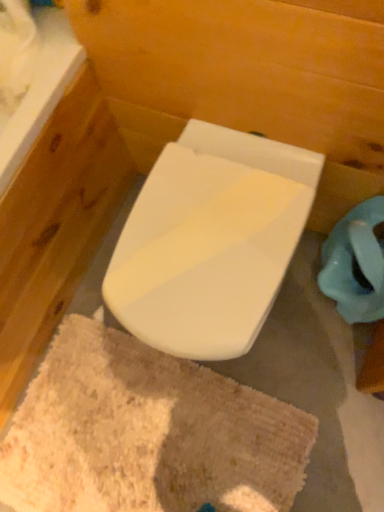
Question: Is beige shaggy bath mat at center in front of or behind white glossy toilet at center in the image?

Choices:
 (A) front
 (B) behind

Answer: (B)

Question: From a real-world perspective, relative to white glossy toilet at center, is beige shaggy bath mat at center vertically above or below?

Choices:
 (A) below
 (B) above

Answer: (A)

Question: Would you say beige shaggy bath mat at center is inside or outside white glossy toilet at center?

Choices:
 (A) inside
 (B) outside

Answer: (B)

Question: From the image's perspective, is white glossy toilet at center above or below beige shaggy bath mat at center?

Choices:
 (A) above
 (B) below

Answer: (A)

Question: Which is correct: white glossy toilet at center is inside beige shaggy bath mat at center, or outside of it?

Choices:
 (A) inside
 (B) outside

Answer: (B)

Question: In the image, is white glossy toilet at center positioned in front of or behind beige shaggy bath mat at center?

Choices:
 (A) front
 (B) behind

Answer: (A)

Question: Is white glossy toilet at center wider or thinner than beige shaggy bath mat at center?

Choices:
 (A) thin
 (B) wide

Answer: (A)